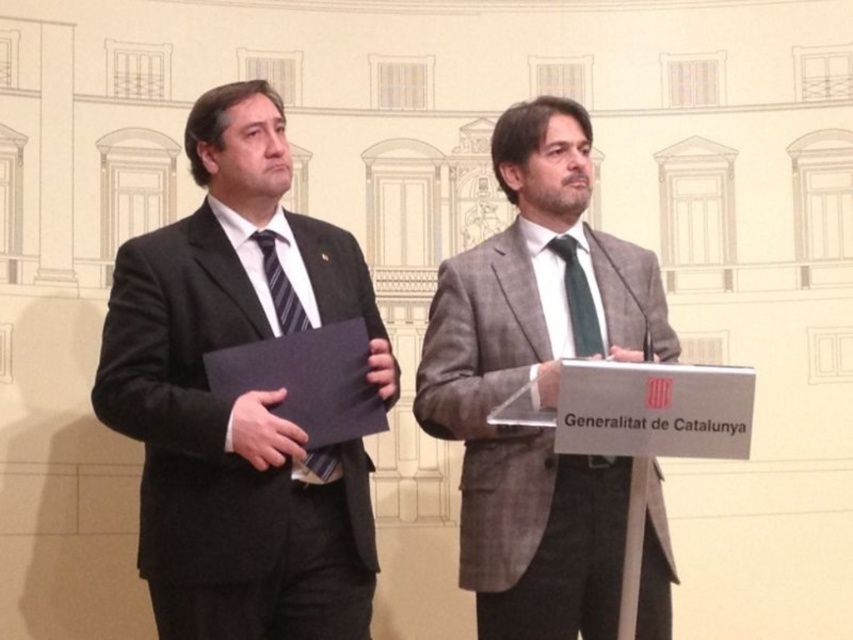
Question: Among these points, which one is farthest from the camera?

Choices:
 (A) pyautogui.click(x=146, y=492)
 (B) pyautogui.click(x=598, y=340)
 (C) pyautogui.click(x=306, y=320)
 (D) pyautogui.click(x=532, y=573)

Answer: (B)

Question: Which of the following is the farthest from the observer?

Choices:
 (A) green silk tie at center
 (B) striped fabric tie at left
 (C) gray textured suit at center

Answer: (A)

Question: Does matte black suit at left appear over striped fabric tie at left?

Choices:
 (A) no
 (B) yes

Answer: (A)

Question: Which of the following is the farthest from the observer?

Choices:
 (A) (553, 246)
 (B) (189, 518)

Answer: (A)

Question: Is striped fabric tie at left to the left of green silk tie at center from the viewer's perspective?

Choices:
 (A) no
 (B) yes

Answer: (B)

Question: Does matte black suit at left appear on the right side of green silk tie at center?

Choices:
 (A) no
 (B) yes

Answer: (A)